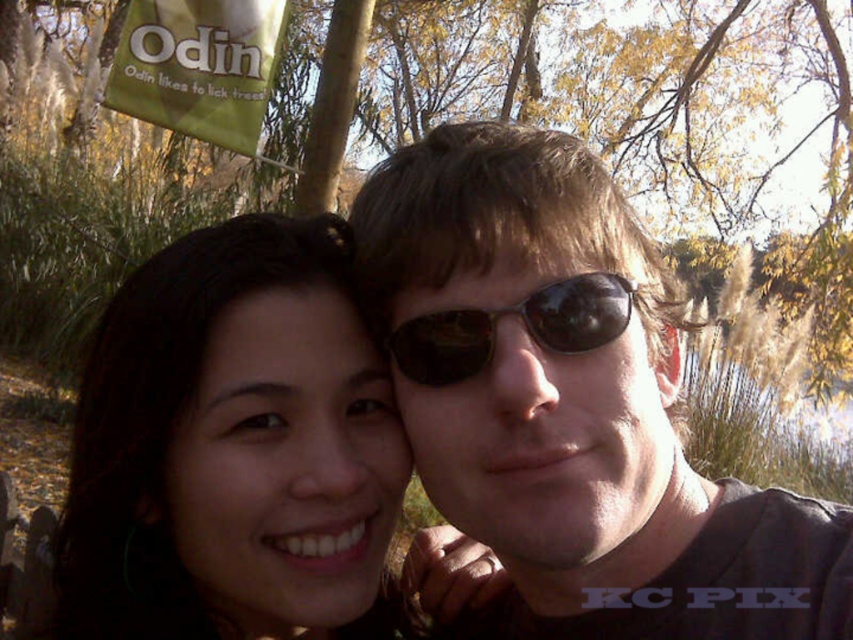
Question: Is matte black sunglasses at center smaller than dark brown hair at center?

Choices:
 (A) yes
 (B) no

Answer: (B)

Question: Does matte black sunglasses at center have a greater width compared to black reflective sunglasses at center?

Choices:
 (A) no
 (B) yes

Answer: (B)

Question: Which of the following is the farthest from the observer?

Choices:
 (A) (180, 298)
 (B) (422, 355)
 (C) (639, 497)

Answer: (A)

Question: Estimate the real-world distances between objects in this image. Which object is closer to the matte black sunglasses at center?

Choices:
 (A) black reflective sunglasses at center
 (B) dark brown hair at center

Answer: (A)

Question: Estimate the real-world distances between objects in this image. Which object is closer to the matte black sunglasses at center?

Choices:
 (A) dark brown hair at center
 (B) black reflective sunglasses at center

Answer: (B)

Question: Does matte black sunglasses at center appear on the left side of dark brown hair at center?

Choices:
 (A) no
 (B) yes

Answer: (A)